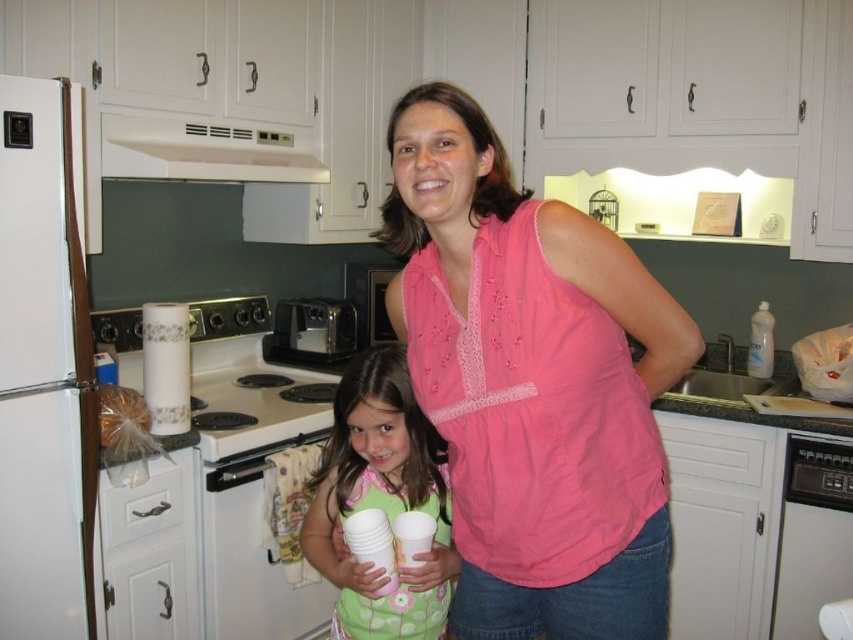
Which is above, green polka dot dress at center or black plastic dishwasher at lower right?

green polka dot dress at center

Can you confirm if green polka dot dress at center is shorter than black plastic dishwasher at lower right?

No.

At what (x,y) coordinates should I click in order to perform the action: click on green polka dot dress at center. Please return your answer as a coordinate pair (x, y). Looking at the image, I should click on (380, 500).

Locate an element on the screen. green polka dot dress at center is located at coordinates (380, 500).

Which is more to the right, black metallic toaster at center or clear plastic bottle at right?

clear plastic bottle at right

Which is behind, point (310, 307) or point (753, 362)?

Positioned behind is point (310, 307).

Locate an element on the screen. The image size is (853, 640). black metallic toaster at center is located at coordinates (314, 330).

Does point (218, 173) come farther from viewer compared to point (347, 291)?

No, it is not.

Does point (289, 157) come closer to viewer compared to point (381, 307)?

Yes, point (289, 157) is in front of point (381, 307).

Is point (166, 154) in front of point (381, 332)?

Yes, point (166, 154) is closer to viewer.

At what (x,y) coordinates should I click in order to perform the action: click on white matte exhaust hood at upper center. Please return your answer as a coordinate pair (x, y). The image size is (853, 640). Looking at the image, I should click on (206, 150).